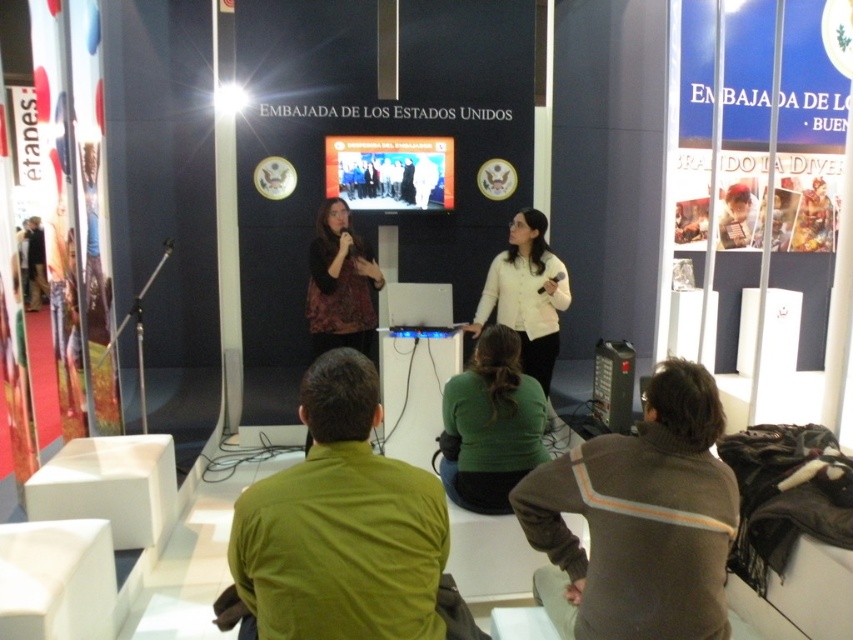
Question: Can you confirm if brown sweater at lower right is positioned below patterned fabric shirt at center?

Choices:
 (A) no
 (B) yes

Answer: (B)

Question: Is white matte shirt at center closer to the viewer compared to patterned fabric shirt at center?

Choices:
 (A) no
 (B) yes

Answer: (B)

Question: Can you confirm if green matte shirt at center is smaller than white matte shirt at center?

Choices:
 (A) no
 (B) yes

Answer: (B)

Question: Considering the real-world distances, which object is farthest from the green matte shirt at lower center?

Choices:
 (A) white matte shirt at center
 (B) brown sweater at lower right

Answer: (A)

Question: Which point is farther to the camera?

Choices:
 (A) green matte shirt at lower center
 (B) patterned fabric shirt at center
 (C) brown sweater at lower right
 (D) white matte shirt at center

Answer: (B)

Question: Which of the following is the closest to the observer?

Choices:
 (A) (718, 435)
 (B) (297, 502)
 (C) (503, 307)
 (D) (311, 304)

Answer: (B)